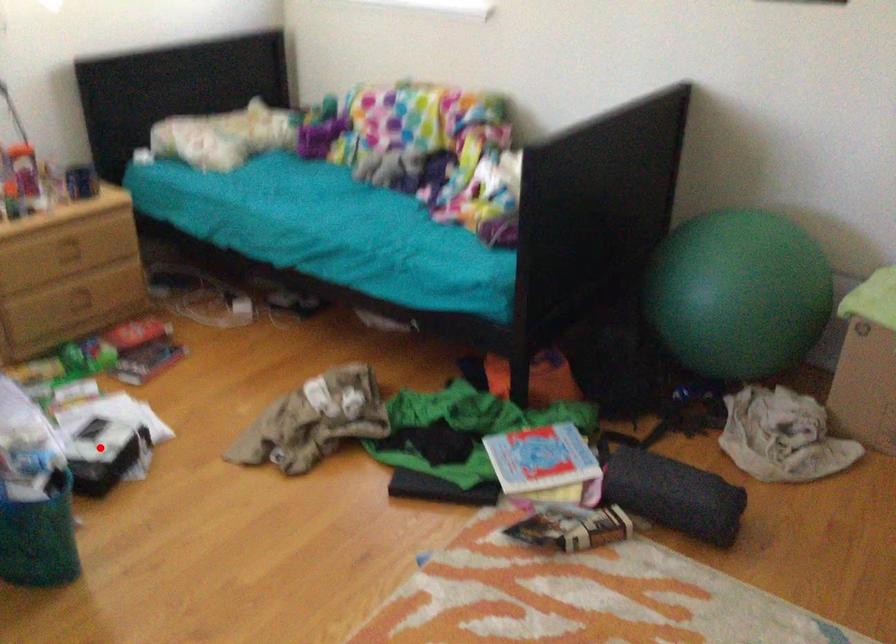
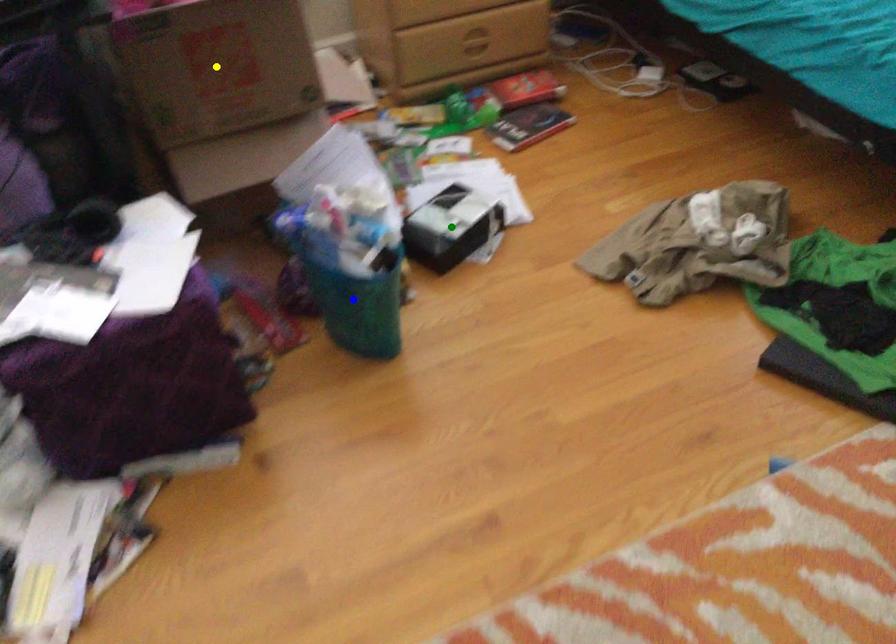
Question: I am providing you with two images of the same scene from different viewpoints. A red point is marked on the first image. You are given multiple points on the second image. In image 2, which mark is for the same physical point as the one in image 1?

Choices:
 (A) green point
 (B) blue point
 (C) yellow point

Answer: (A)